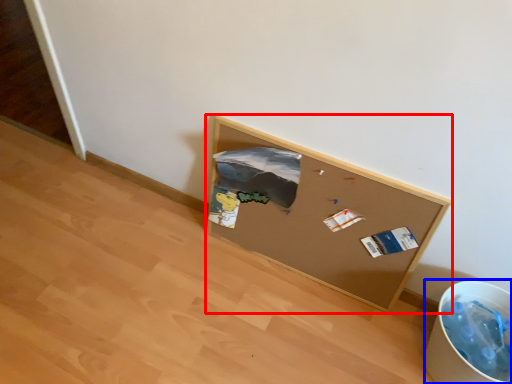
Question: Among these objects, which one is nearest to the camera, furniture (highlighted by a red box) or recycling bin (highlighted by a blue box)?

Choices:
 (A) furniture
 (B) recycling bin

Answer: (B)